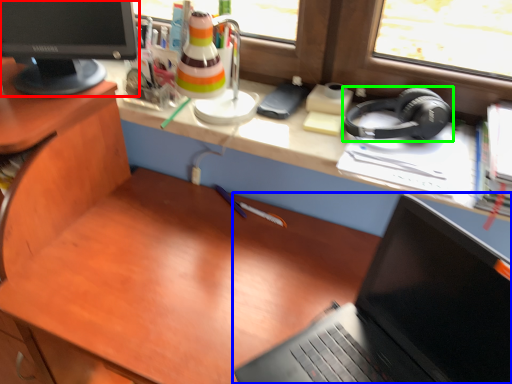
Question: Considering the real-world distances, which object is farthest from computer monitor (highlighted by a red box)? laptop (highlighted by a blue box) or headphones (highlighted by a green box)?

Choices:
 (A) laptop
 (B) headphones

Answer: (A)